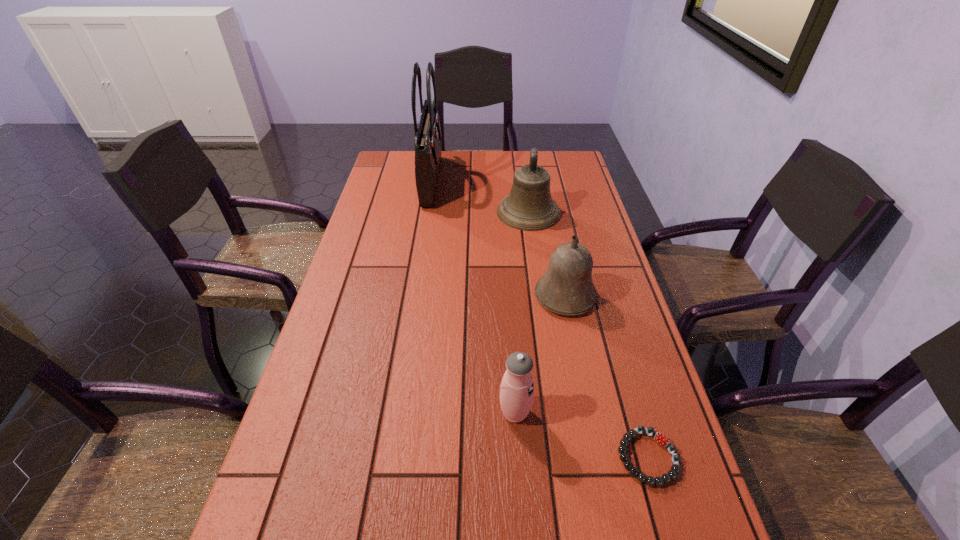
Find the location of a particular element. free spot located on the back of the shorter bell is located at coordinates (547, 209).

The width and height of the screenshot is (960, 540). In order to click on vacant space positioned 0.150m on the front of the second nearest object in this screenshot , I will do `click(521, 505)`.

The height and width of the screenshot is (540, 960). Find the location of `vacant area situated on the back of the shortest object`. vacant area situated on the back of the shortest object is located at coordinates (632, 402).

At what (x,y) coordinates should I click in order to perform the action: click on object present at the far edge. Please return your answer as a coordinate pair (x, y). Image resolution: width=960 pixels, height=540 pixels. Looking at the image, I should click on 428,139.

At what (x,y) coordinates should I click in order to perform the action: click on bracelet at the right edge. Please return your answer as a coordinate pair (x, y). Looking at the image, I should click on (660, 438).

What are the coordinates of `vacant space at the far edge of the desktop` in the screenshot? It's located at (467, 169).

This screenshot has height=540, width=960. Find the location of `vacant region at the left edge of the desktop`. vacant region at the left edge of the desktop is located at coordinates (268, 525).

Locate an element on the screen. The height and width of the screenshot is (540, 960). free region at the far right corner of the desktop is located at coordinates (562, 178).

The image size is (960, 540). Find the location of `free space that is in between the nearest object and the thermos bottle`. free space that is in between the nearest object and the thermos bottle is located at coordinates (582, 435).

Image resolution: width=960 pixels, height=540 pixels. I want to click on free spot between the farther bell and the shorter bell, so click(547, 254).